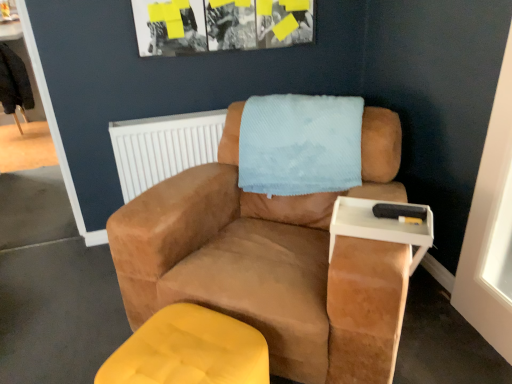
Question: From a real-world perspective, is white plastic tray at right above or below suede brown armchair at center?

Choices:
 (A) above
 (B) below

Answer: (A)

Question: Is white plastic tray at right in front of or behind suede brown armchair at center in the image?

Choices:
 (A) behind
 (B) front

Answer: (A)

Question: Estimate the real-world distances between objects in this image. Which object is farther from the white plastic radiator at upper center?

Choices:
 (A) suede brown armchair at center
 (B) matte yellow ottoman at lower left
 (C) white plastic tray at right

Answer: (B)

Question: Considering the real-world distances, which object is farthest from the suede brown armchair at center?

Choices:
 (A) white plastic radiator at upper center
 (B) matte yellow ottoman at lower left
 (C) white plastic tray at right

Answer: (A)